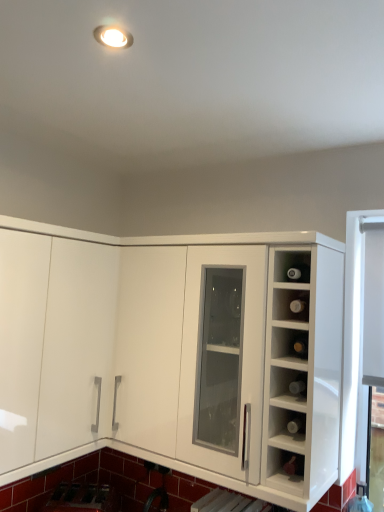
Question: Is white glossy cabinet at center to the left or to the right of metallic silver sink at lower left in the image?

Choices:
 (A) right
 (B) left

Answer: (A)

Question: From the image's perspective, is white glossy cabinet at center positioned above or below metallic silver sink at lower left?

Choices:
 (A) above
 (B) below

Answer: (A)

Question: Which object is positioned farthest from the transparent glass bottles at right?

Choices:
 (A) metallic silver sink at lower left
 (B) matte glass wine bottle at upper right
 (C) white glossy cabinet at center

Answer: (A)

Question: Which object is the closest to the transparent glass bottles at right?

Choices:
 (A) white glossy cabinet at center
 (B) metallic silver sink at lower left
 (C) matte glass wine bottle at upper right

Answer: (C)